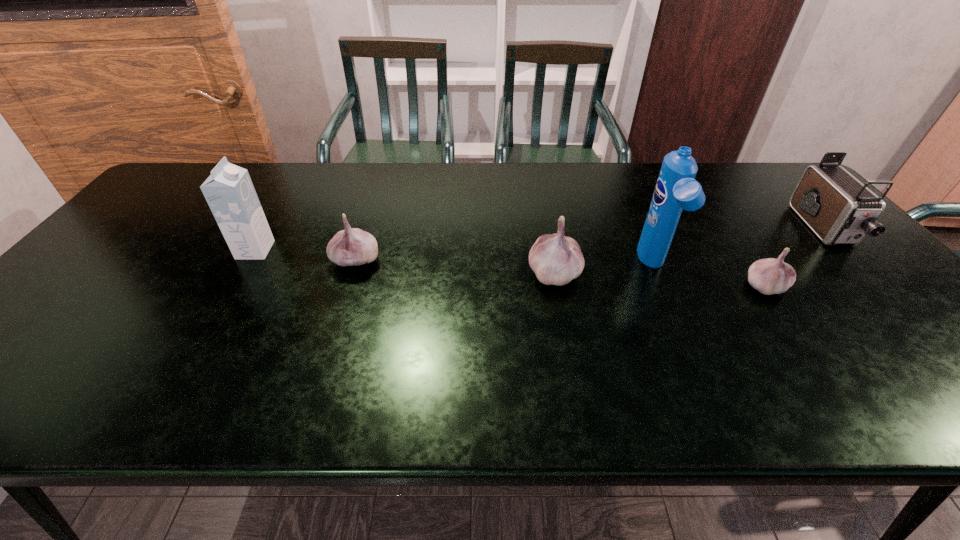
Please point out where to position a new garlic on the left to maintain spacing. Please provide its 2D coordinates. Your answer should be formatted as a tuple, i.e. [(x, y)], where the tuple contains the x and y coordinates of a point satisfying the conditions above.

[(170, 248)]